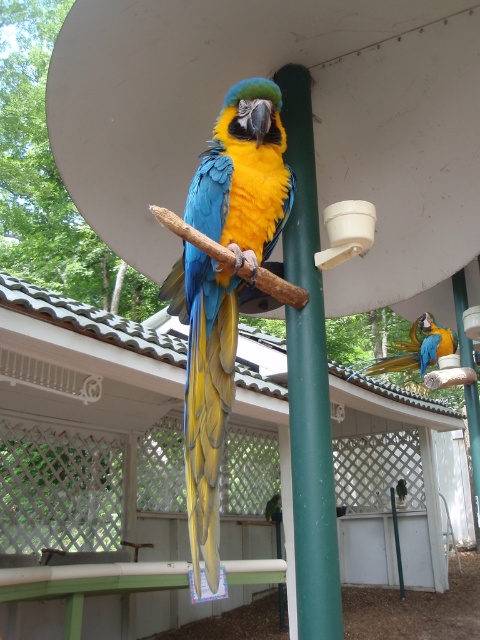
Question: Does green matte pole at center appear under blue glossy parrot at center?

Choices:
 (A) yes
 (B) no

Answer: (B)

Question: Which of these objects is positioned closest to the shiny blue-green parrot at center?

Choices:
 (A) blue glossy parrot at center
 (B) green matte pole at center

Answer: (B)

Question: Observing the image, what is the correct spatial positioning of shiny blue-green parrot at center in reference to blue glossy parrot at center?

Choices:
 (A) left
 (B) right

Answer: (A)

Question: Which point is farther to the camera?

Choices:
 (A) (302, 160)
 (B) (433, 333)

Answer: (B)

Question: Does shiny blue-green parrot at center have a larger size compared to green matte pole at center?

Choices:
 (A) no
 (B) yes

Answer: (B)

Question: Which point appears closest to the camera in this image?

Choices:
 (A) (441, 340)
 (B) (190, 467)

Answer: (B)